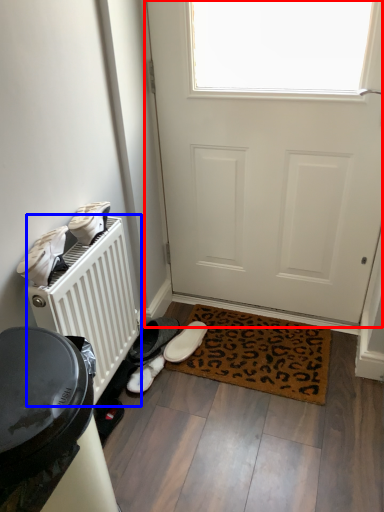
Question: Among these objects, which one is farthest to the camera, door (highlighted by a red box) or radiator (highlighted by a blue box)?

Choices:
 (A) door
 (B) radiator

Answer: (A)